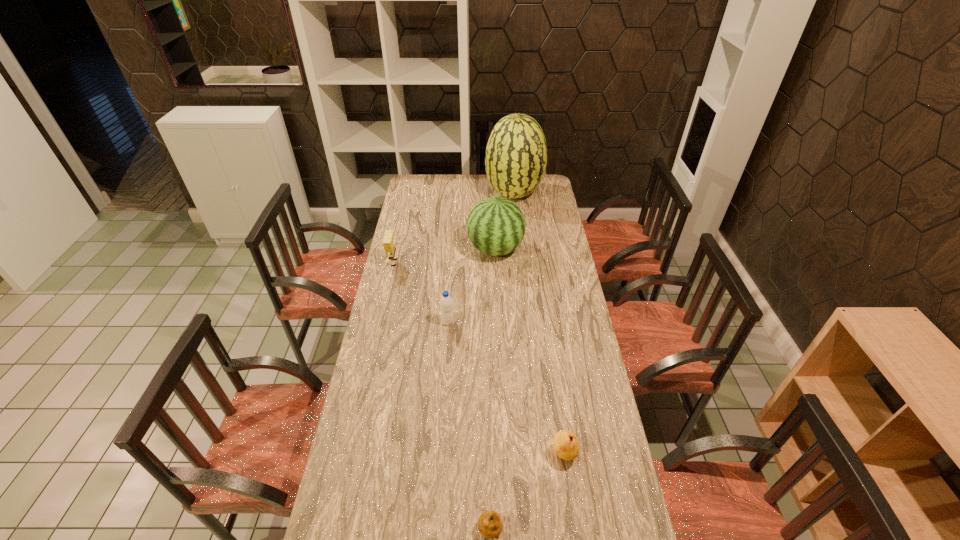
This screenshot has height=540, width=960. I want to click on vacant space located on the left of the nearer watermelon, so click(x=453, y=249).

Where is `vacant area situated on the back of the second object from left to right`? This screenshot has width=960, height=540. vacant area situated on the back of the second object from left to right is located at coordinates (449, 293).

Locate an element on the screen. This screenshot has height=540, width=960. free space located on the face of the leftmost object is located at coordinates (423, 263).

Find the location of a particular element. vacant point located on the back of the right pear is located at coordinates (551, 369).

At what (x,y) coordinates should I click in order to perform the action: click on object located at the far edge. Please return your answer as a coordinate pair (x, y). This screenshot has height=540, width=960. Looking at the image, I should click on (516, 155).

Where is `object present at the left edge`? The height and width of the screenshot is (540, 960). object present at the left edge is located at coordinates (389, 242).

Locate an element on the screen. Image resolution: width=960 pixels, height=540 pixels. watermelon that is at the right edge is located at coordinates pyautogui.click(x=516, y=155).

Identify the location of pear located in the right edge section of the desktop. The image size is (960, 540). (565, 443).

Image resolution: width=960 pixels, height=540 pixels. What are the coordinates of `object positioned at the far right corner` in the screenshot? It's located at (516, 155).

In the image, there is a desktop. Find the location of `blank space at the far edge`. blank space at the far edge is located at coordinates (478, 177).